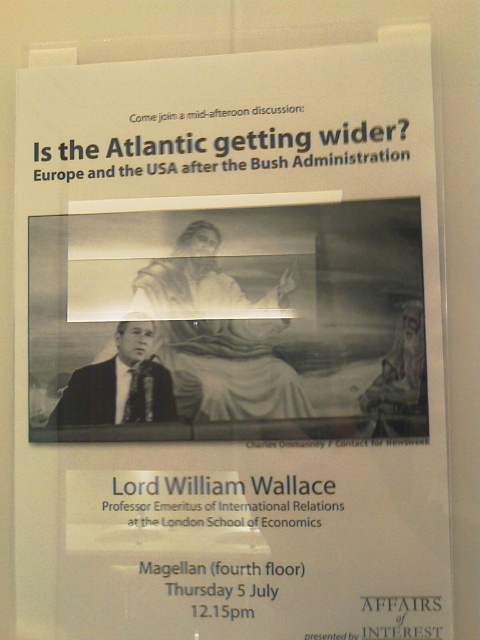
Question: Which point appears closest to the camera in this image?

Choices:
 (A) (121, 420)
 (B) (186, 394)

Answer: (B)

Question: Which object appears farthest from the camera in this image?

Choices:
 (A) matte black suit at center
 (B) white paper at center

Answer: (A)

Question: Does white paper at center have a larger size compared to matte black suit at center?

Choices:
 (A) yes
 (B) no

Answer: (A)

Question: Does white paper at center come in front of matte black suit at center?

Choices:
 (A) no
 (B) yes

Answer: (B)

Question: Does white paper at center have a greater width compared to matte black suit at center?

Choices:
 (A) no
 (B) yes

Answer: (B)